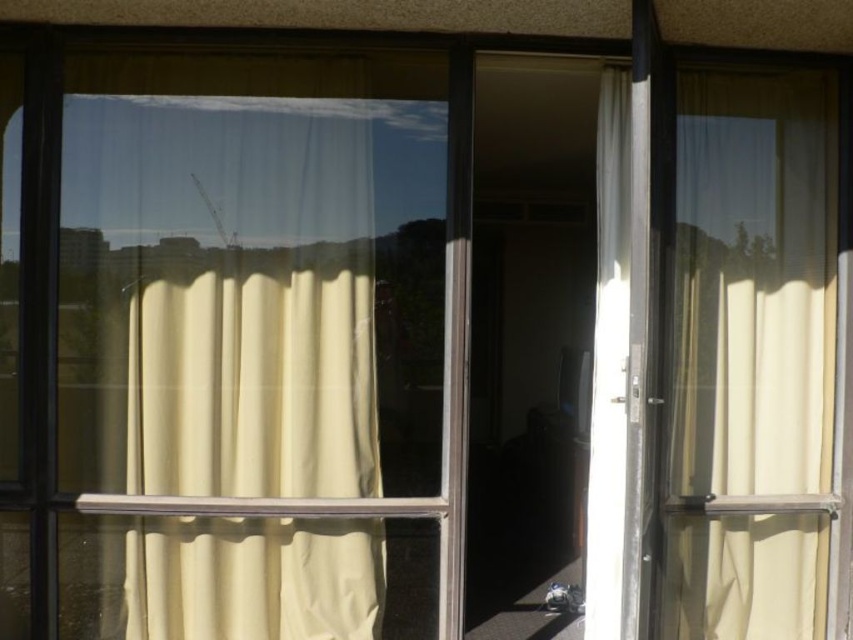
You are standing inside a room and looking through the window. There are two sheer curtains, the white sheer curtain at left and the beige sheer curtain at right. Which curtain is closer to the left side of the window?

The white sheer curtain at left is closer to the left side of the window because it is positioned to the left of the beige sheer curtain at right.

You are an interior designer trying to hang a decorative tapestry that is 16 inches wide between the beige sheer curtain at right and the white sheer curtain at center. Based on the scene, will the tapestry fit without overlapping either curtain?

The distance between the beige sheer curtain at right and the white sheer curtain at center is 17.05 inches. Since the tapestry is 16 inches wide, it will fit between them without overlapping either curtain as there is enough space.

You are standing in the room looking through the window. There are two points marked on the window glass at coordinates point (257,524) and point (601,608). Which point is nearer to you?

Point (257,524) is closer to the viewer than point (601,608).